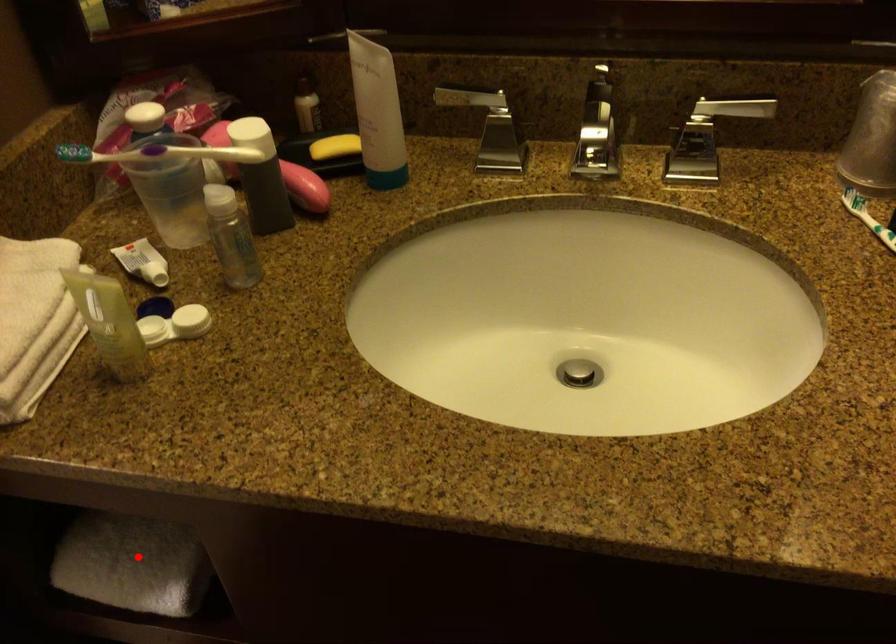
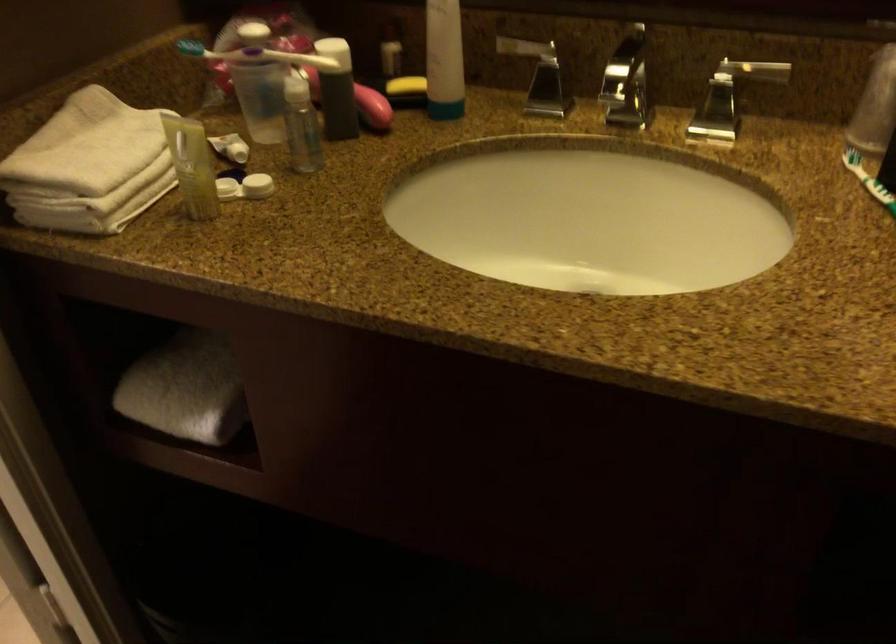
Locate, in the second image, the point that corresponds to the highlighted location in the first image.

(185, 389)